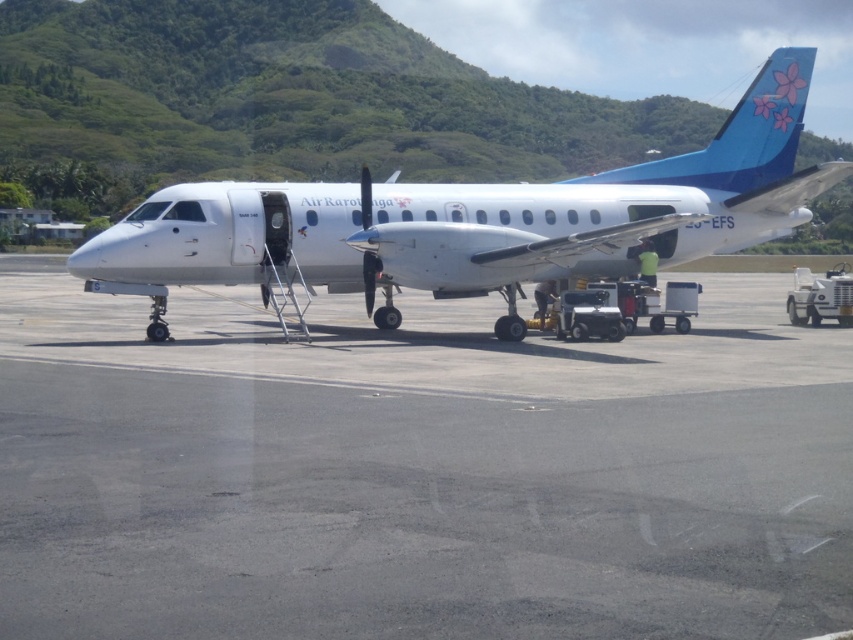
From the picture: Is gray asphalt tarmac at center positioned behind white matte airplane at center?

No, gray asphalt tarmac at center is closer to the viewer.

Measure the distance between point (590, 532) and camera.

Point (590, 532) and camera are 5.92 meters apart.

Where is `gray asphalt tarmac at center`? Image resolution: width=853 pixels, height=640 pixels. gray asphalt tarmac at center is located at coordinates (416, 472).